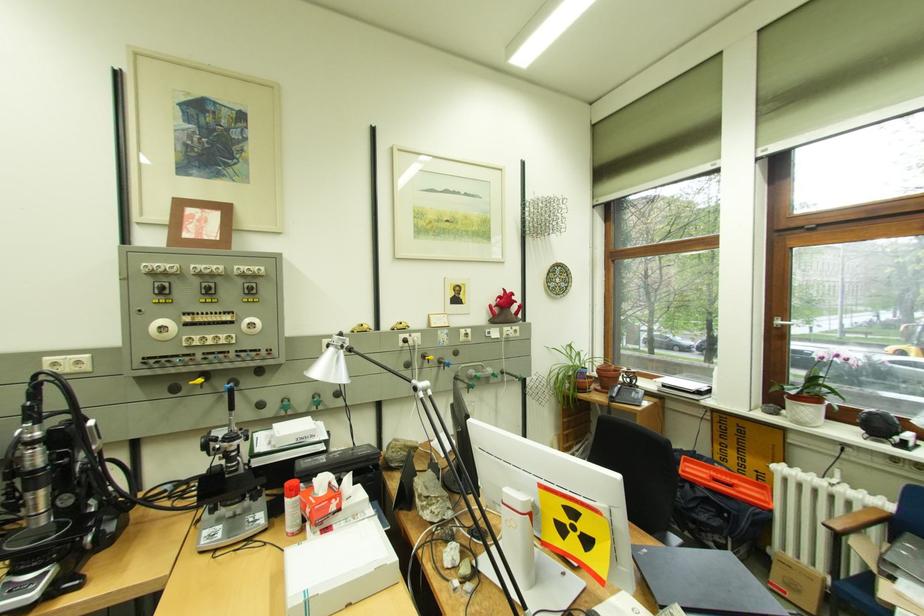
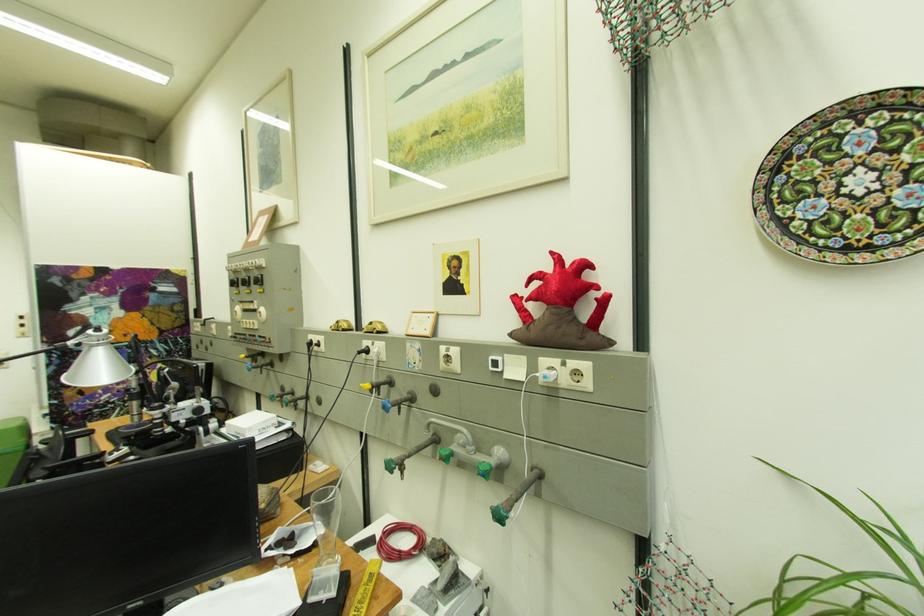
Find the pixel in the second image that matches the point at 513,294 in the first image.

(560, 267)